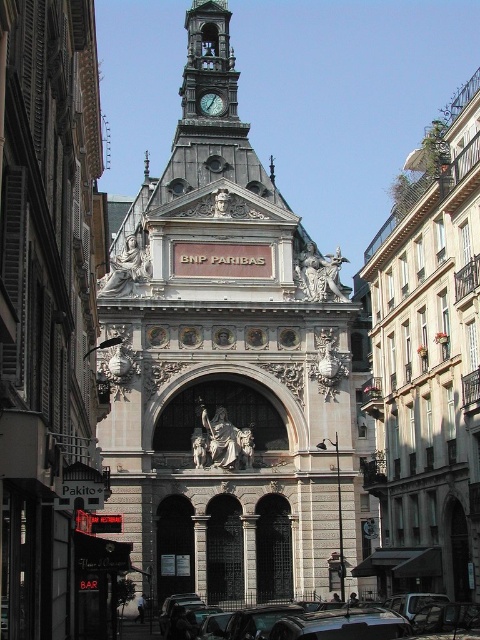
Does white marble church at center appear over shiny metallic car at center?

Yes.

Does white marble church at center have a greater height compared to shiny metallic car at center?

Correct, white marble church at center is much taller as shiny metallic car at center.

Is point (85, 385) farther from camera compared to point (315, 611)?

That is False.

I want to click on white marble church at center, so click(x=46, y=300).

Can you confirm if white marble church at center is thinner than white stone church at center?

Yes.

Is point (52, 589) farther from camera compared to point (395, 531)?

No, (52, 589) is closer to viewer.

Where is `white marble church at center`? white marble church at center is located at coordinates (46, 300).

Is shiny metallic car at center wider than green glass clock at upper center?

Correct, the width of shiny metallic car at center exceeds that of green glass clock at upper center.

Does shiny metallic car at center have a smaller size compared to green glass clock at upper center?

Incorrect, shiny metallic car at center is not smaller in size than green glass clock at upper center.

Between point (316, 621) and point (219, 109), which one is positioned in front?

Point (316, 621)

This screenshot has width=480, height=640. In order to click on shiny metallic car at center in this screenshot , I will do `click(342, 625)`.